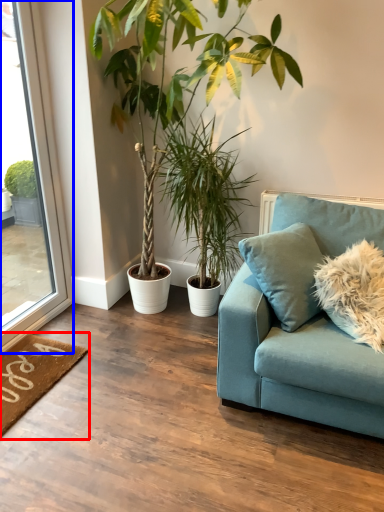
Question: Which point is closer to the camera, doormat (highlighted by a red box) or window (highlighted by a blue box)?

Choices:
 (A) doormat
 (B) window

Answer: (B)